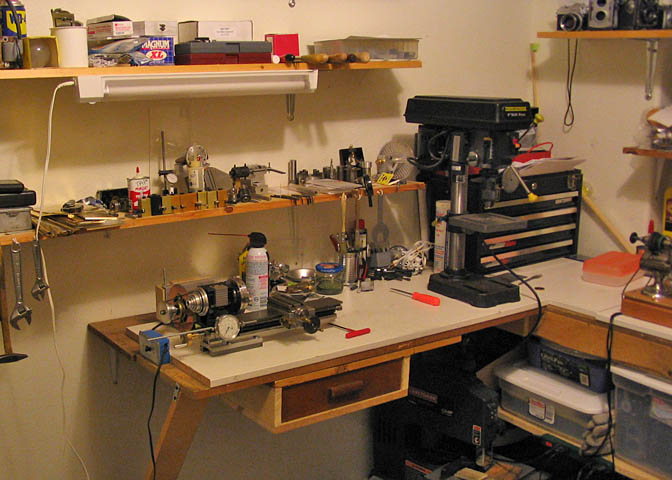
Locate an element on the screen. This screenshot has height=480, width=672. desk is located at coordinates (408, 334).